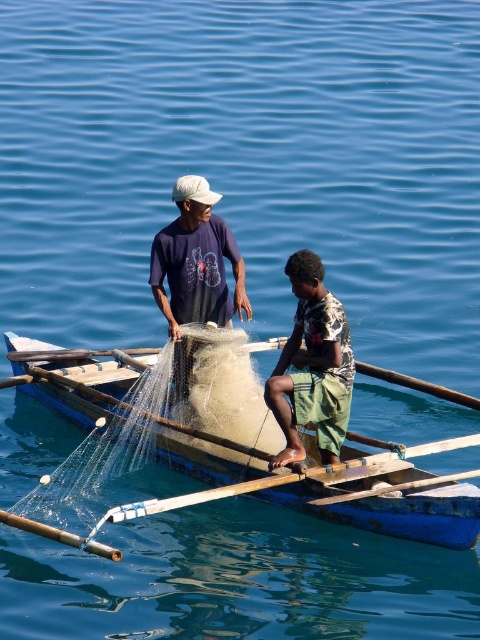
You are on a boat and need to reach the wooden smooth paddle at center to row. However, there is a printed fabric shirt at center in your way. Based on their positions, can you easily access the paddle?

The printed fabric shirt at center is above the wooden smooth paddle at center, so you cannot easily access the paddle without moving the shirt first.

You are on the boat and need to reach both the point at coordinates point (326, 429) and point (453, 480). Which point should you go to first to minimize walking distance?

You should go to point (326, 429) first because it is closer to you than point (453, 480).